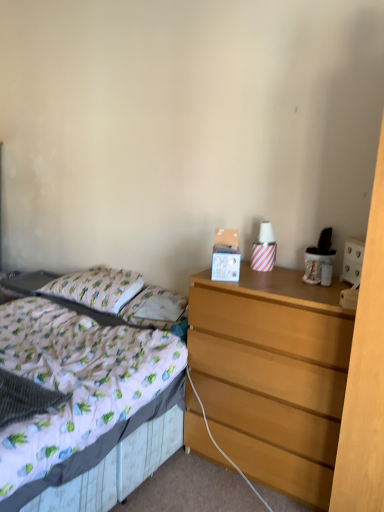
Question: Could you tell me if wooden chest of drawers at right is facing white fabric pillow at center, marked as the 2th pillow in a left-to-right arrangement?

Choices:
 (A) no
 (B) yes

Answer: (A)

Question: Does wooden chest of drawers at right have a larger size compared to white fabric pillow at center, marked as the 2th pillow in a left-to-right arrangement?

Choices:
 (A) no
 (B) yes

Answer: (B)

Question: Considering the relative sizes of wooden chest of drawers at right and white fabric pillow at center, marked as the 2th pillow in a left-to-right arrangement, in the image provided, is wooden chest of drawers at right taller than white fabric pillow at center, marked as the 2th pillow in a left-to-right arrangement,?

Choices:
 (A) no
 (B) yes

Answer: (B)

Question: Is wooden chest of drawers at right turned away from white fabric pillow at center, marked as the 2th pillow in a left-to-right arrangement?

Choices:
 (A) no
 (B) yes

Answer: (A)

Question: Would you say wooden chest of drawers at right is a long distance from white fabric pillow at center, marked as the 2th pillow in a left-to-right arrangement?

Choices:
 (A) no
 (B) yes

Answer: (A)

Question: From a real-world perspective, is wooden chest of drawers at right on top of white fabric pillow at center, marked as the 2th pillow in a left-to-right arrangement?

Choices:
 (A) no
 (B) yes

Answer: (A)

Question: Does white fabric bed at left have a smaller size compared to wooden chest of drawers at right?

Choices:
 (A) no
 (B) yes

Answer: (A)

Question: From a real-world perspective, is white fabric bed at left located higher than wooden chest of drawers at right?

Choices:
 (A) no
 (B) yes

Answer: (A)

Question: Considering the relative positions of white fabric bed at left and wooden chest of drawers at right in the image provided, is white fabric bed at left behind wooden chest of drawers at right?

Choices:
 (A) yes
 (B) no

Answer: (B)

Question: Considering the relative sizes of white fabric bed at left and wooden chest of drawers at right in the image provided, is white fabric bed at left taller than wooden chest of drawers at right?

Choices:
 (A) yes
 (B) no

Answer: (B)

Question: From the image's perspective, would you say white fabric bed at left is shown under wooden chest of drawers at right?

Choices:
 (A) no
 (B) yes

Answer: (B)

Question: From a real-world perspective, is white fabric bed at left beneath wooden chest of drawers at right?

Choices:
 (A) no
 (B) yes

Answer: (B)

Question: Is white fabric pillow at center, marked as the 2th pillow in a left-to-right arrangement, positioned in front of cotton/cotton-like pillow at left, arranged as the 1th pillow when viewed from the left?

Choices:
 (A) yes
 (B) no

Answer: (A)